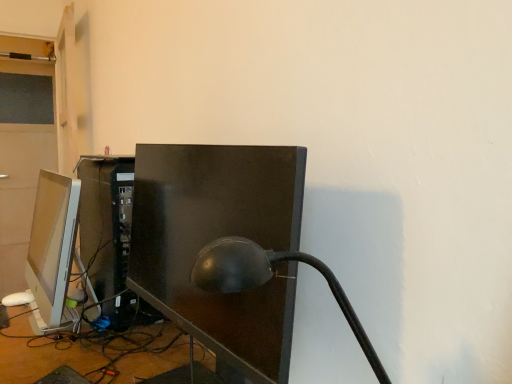
Question: Does matte black lamp at center have a greater width compared to matte white monitor at left, positioned as the second computer monitor in right-to-left order?

Choices:
 (A) no
 (B) yes

Answer: (B)

Question: From a real-world perspective, is matte black lamp at center located higher than matte white monitor at left, the 1th computer monitor in the left-to-right sequence?

Choices:
 (A) yes
 (B) no

Answer: (A)

Question: Considering the relative sizes of matte black lamp at center and matte white monitor at left, positioned as the second computer monitor in right-to-left order, in the image provided, is matte black lamp at center shorter than matte white monitor at left, positioned as the second computer monitor in right-to-left order,?

Choices:
 (A) no
 (B) yes

Answer: (B)

Question: Considering the relative sizes of matte black lamp at center and matte white monitor at left, the 1th computer monitor in the left-to-right sequence, in the image provided, is matte black lamp at center smaller than matte white monitor at left, the 1th computer monitor in the left-to-right sequence,?

Choices:
 (A) yes
 (B) no

Answer: (A)

Question: Is matte black lamp at center not inside matte white monitor at left, positioned as the second computer monitor in right-to-left order?

Choices:
 (A) no
 (B) yes

Answer: (B)

Question: Visually, is matte black lamp at center positioned to the left or to the right of matte black monitor at center, placed as the second computer monitor when sorted from left to right?

Choices:
 (A) right
 (B) left

Answer: (A)

Question: From the image's perspective, is matte black lamp at center above or below matte black monitor at center, placed as the 1th computer monitor when sorted from right to left?

Choices:
 (A) above
 (B) below

Answer: (B)

Question: From their relative heights in the image, would you say matte black lamp at center is taller or shorter than matte black monitor at center, placed as the second computer monitor when sorted from left to right?

Choices:
 (A) tall
 (B) short

Answer: (B)

Question: From a real-world perspective, is matte black lamp at center positioned above or below matte black monitor at center, placed as the 1th computer monitor when sorted from right to left?

Choices:
 (A) below
 (B) above

Answer: (B)

Question: From a real-world perspective, relative to matte black monitor at center, placed as the second computer monitor when sorted from left to right, is matte white monitor at left, positioned as the second computer monitor in right-to-left order, vertically above or below?

Choices:
 (A) above
 (B) below

Answer: (B)

Question: From the image's perspective, is matte white monitor at left, positioned as the second computer monitor in right-to-left order, positioned above or below matte black monitor at center, placed as the 1th computer monitor when sorted from right to left?

Choices:
 (A) above
 (B) below

Answer: (A)

Question: Based on their sizes in the image, would you say matte white monitor at left, positioned as the second computer monitor in right-to-left order, is bigger or smaller than matte black monitor at center, placed as the second computer monitor when sorted from left to right?

Choices:
 (A) small
 (B) big

Answer: (A)

Question: Considering the relative positions of matte white monitor at left, positioned as the second computer monitor in right-to-left order, and matte black monitor at center, placed as the second computer monitor when sorted from left to right, in the image provided, is matte white monitor at left, positioned as the second computer monitor in right-to-left order, to the left or to the right of matte black monitor at center, placed as the second computer monitor when sorted from left to right,?

Choices:
 (A) right
 (B) left

Answer: (B)

Question: Looking at the image, does matte black lamp at center seem bigger or smaller compared to matte white monitor at left, the 1th computer monitor in the left-to-right sequence?

Choices:
 (A) small
 (B) big

Answer: (A)

Question: Considering the positions of matte black lamp at center and matte white monitor at left, positioned as the second computer monitor in right-to-left order, in the image, is matte black lamp at center taller or shorter than matte white monitor at left, positioned as the second computer monitor in right-to-left order,?

Choices:
 (A) tall
 (B) short

Answer: (B)